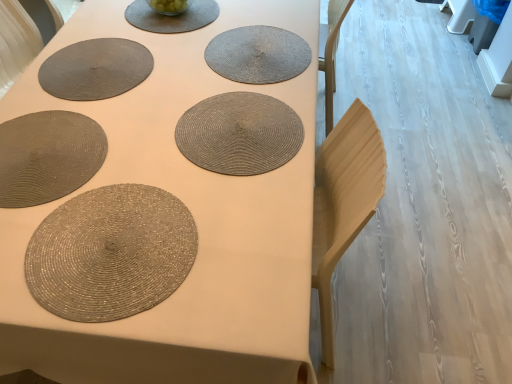
Image resolution: width=512 pixels, height=384 pixels. Identify the location of empty space that is ontop of shiny metallic placemat at bottom left, which ranks as the third paper plate in top-to-bottom order (from a real-world perspective). (104, 241).